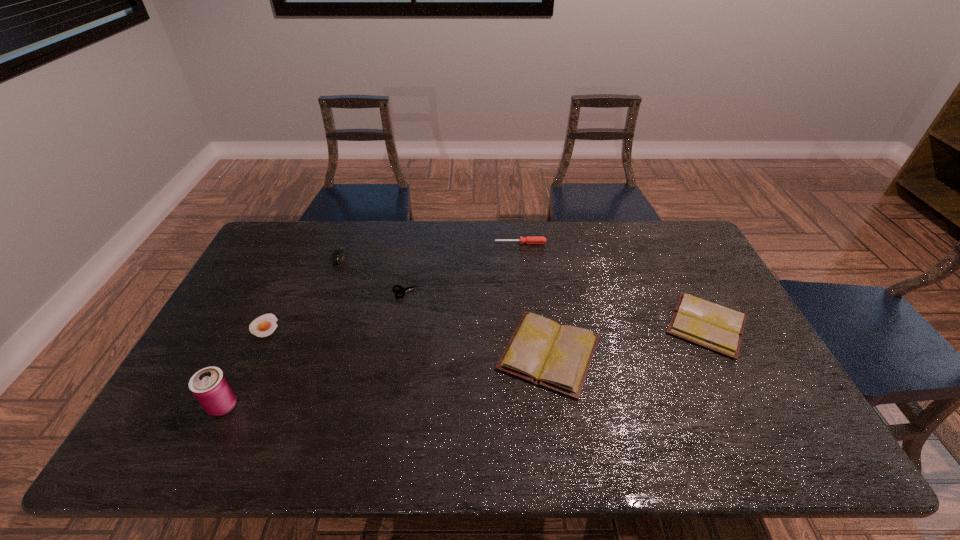
At what (x,y) coordinates should I click in order to perform the action: click on free space at the far right corner of the desktop. Please return your answer as a coordinate pair (x, y). The width and height of the screenshot is (960, 540). Looking at the image, I should click on (691, 256).

The width and height of the screenshot is (960, 540). What are the coordinates of `vacant space at the near right corner of the desktop` in the screenshot? It's located at (755, 404).

Where is `unoccupied area between the taller diary and the can`? unoccupied area between the taller diary and the can is located at coordinates (386, 379).

This screenshot has width=960, height=540. Identify the location of free space between the sixth tallest object and the taller diary. 478,323.

Identify the location of free space between the rightmost object and the taller diary. This screenshot has width=960, height=540. (628, 339).

What are the coordinates of `free area in between the egg yolk and the fourth object from left to right` in the screenshot? It's located at 335,309.

Find the location of a particular element. This screenshot has height=540, width=960. vacant area that lies between the sixth tallest object and the right diary is located at coordinates (557, 309).

Find the location of a particular element. The width and height of the screenshot is (960, 540). vacant space in between the screwdriver and the shears is located at coordinates (464, 268).

The height and width of the screenshot is (540, 960). Identify the location of vacant space that is in between the computer mouse and the second shortest object. (373, 275).

Locate an element on the screen. This screenshot has height=540, width=960. free space between the second shortest object and the third object from left to right is located at coordinates (373, 275).